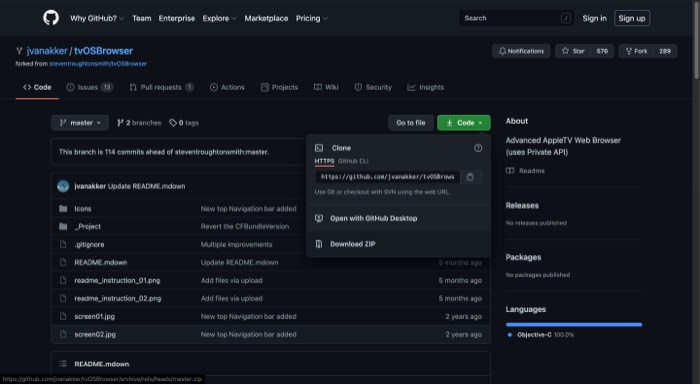
Where is `files and folders`? Image resolution: width=700 pixels, height=385 pixels. files and folders is located at coordinates (90, 208), (90, 223), (103, 240), (96, 256), (99, 275), (102, 292), (99, 312), (103, 337), (113, 364).